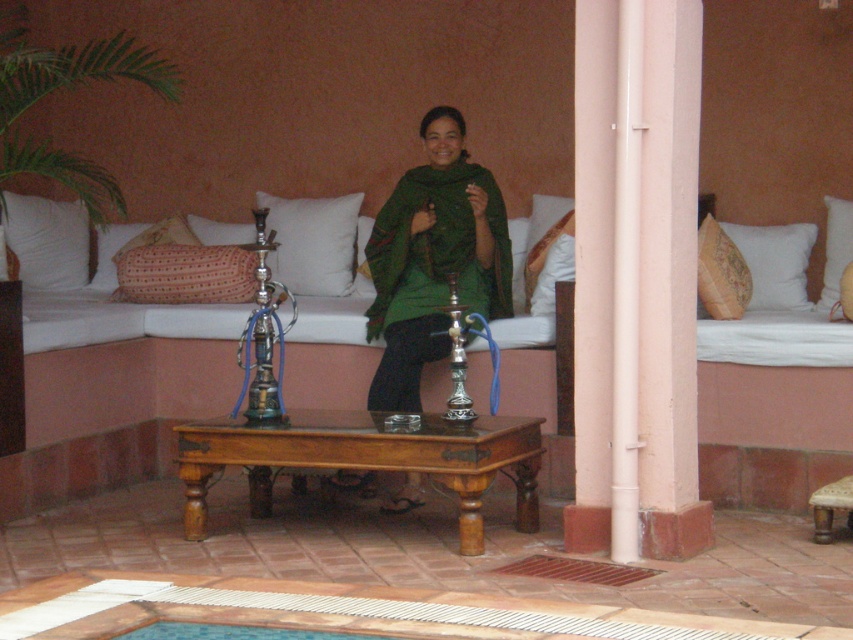
The width and height of the screenshot is (853, 640). Describe the element at coordinates (47, 241) in the screenshot. I see `white soft pillow at upper left` at that location.

Between white soft pillow at upper left and patterned fabric pillow at right, which one appears on the right side from the viewer's perspective?

patterned fabric pillow at right is more to the right.

Locate an element on the screen. This screenshot has width=853, height=640. white soft pillow at upper left is located at coordinates (47, 241).

Based on the photo, can you confirm if textured beige pillow at center is thinner than beige textured pillow at right?

No, textured beige pillow at center is not thinner than beige textured pillow at right.

Consider the image. Who is more forward, (549, 243) or (840, 250)?

Positioned in front is point (549, 243).

Locate an element on the screen. The width and height of the screenshot is (853, 640). textured beige pillow at center is located at coordinates (544, 236).

Is green fabric shawl at center closer to camera compared to white soft pillow at upper left?

That is True.

Does green fabric shawl at center appear under white soft pillow at upper left?

Yes.

Locate an element on the screen. This screenshot has width=853, height=640. green fabric shawl at center is located at coordinates (433, 259).

The height and width of the screenshot is (640, 853). I want to click on green fabric shawl at center, so click(x=433, y=259).